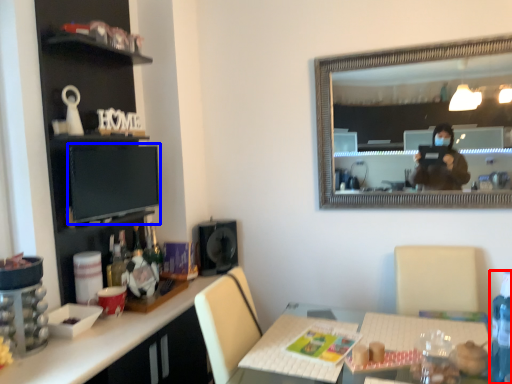
Question: Which point is closer to the camera, bottle (highlighted by a red box) or computer monitor (highlighted by a blue box)?

Choices:
 (A) bottle
 (B) computer monitor

Answer: (A)